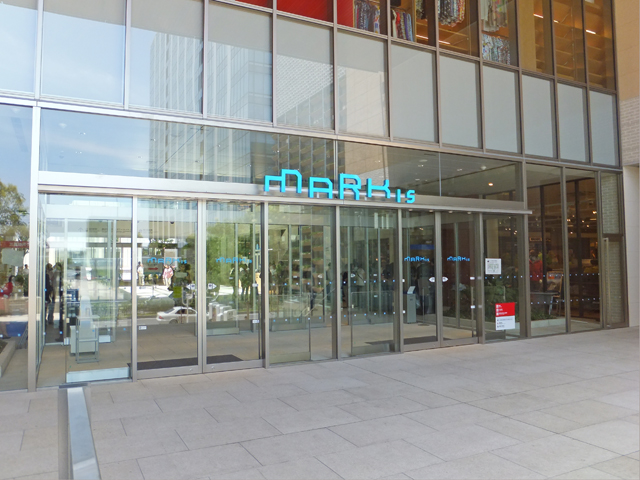
This screenshot has width=640, height=480. Find the location of `black doormats`. black doormats is located at coordinates (180, 362).